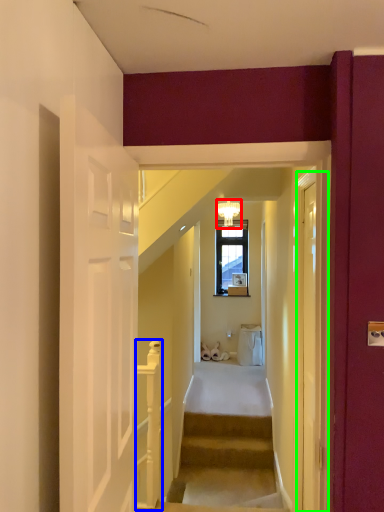
Question: Which is nearer to the light fixture (highlighted by a red box)? rail (highlighted by a blue box) or glass door (highlighted by a green box).

Choices:
 (A) rail
 (B) glass door

Answer: (A)